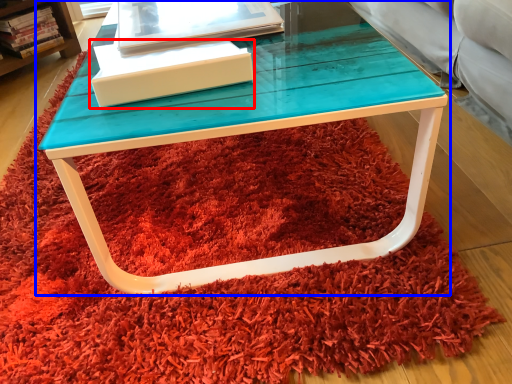
Question: Among these objects, which one is farthest to the camera, box (highlighted by a red box) or table (highlighted by a blue box)?

Choices:
 (A) box
 (B) table

Answer: (A)